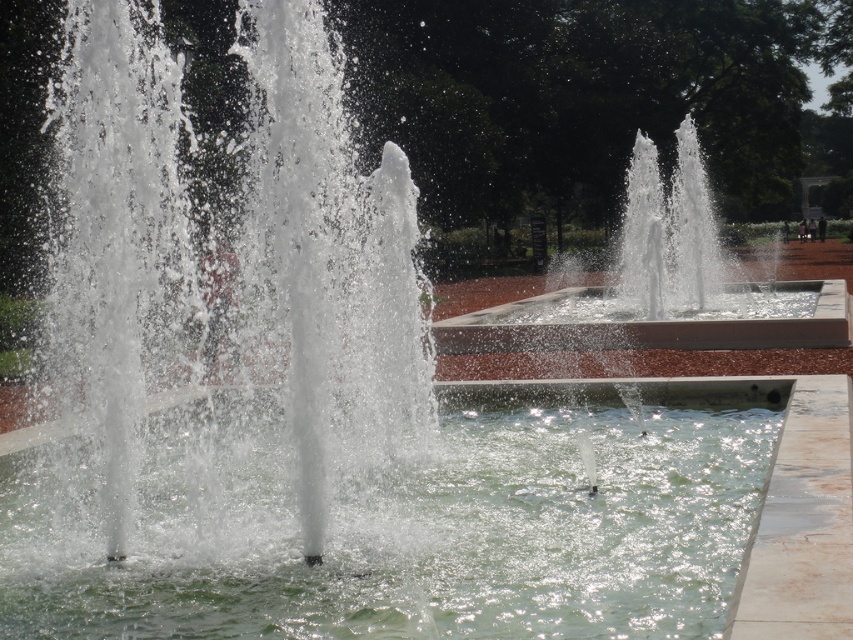
You are designing a water feature for a public space and need to ensure proper drainage. The clear liquid water at center and white glossy water at center are both part of the design. Which of these two water features requires a narrower channel for drainage based on their current dimensions?

The clear liquid water at center requires a narrower channel for drainage since it is thinner than the white glossy water at center.